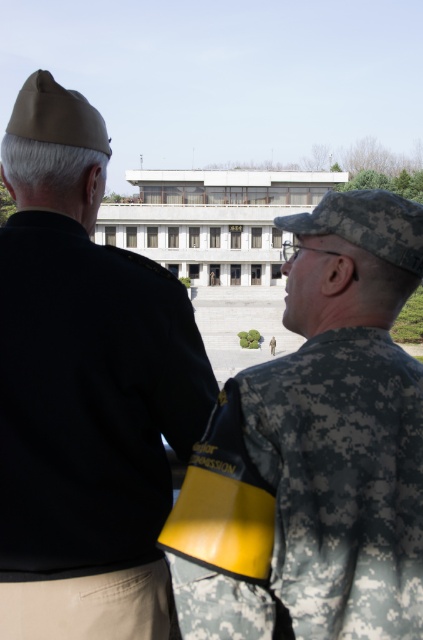
Can you confirm if black matte uniform at upper left is wider than camouflage uniform at center?

Result: No.

Does point (19, 604) come closer to viewer compared to point (302, 611)?

No.

Find the location of a particular element. black matte uniform at upper left is located at coordinates (85, 390).

The image size is (423, 640). What are the coordinates of `black matte uniform at upper left` in the screenshot? It's located at (85, 390).